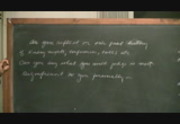
What are the coordinates of `doorway in background` in the screenshot? It's located at (63, 14).